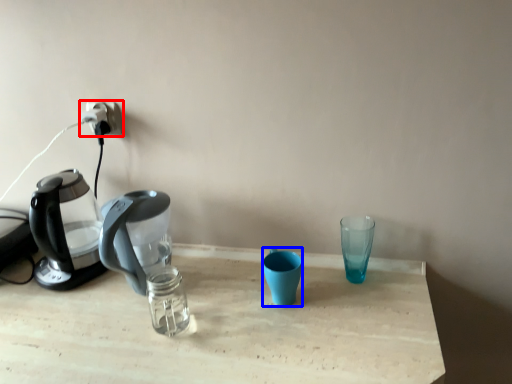
Question: Which of the following is the closest to the observer, power plugs and sockets (highlighted by a red box) or coffee cup (highlighted by a blue box)?

Choices:
 (A) power plugs and sockets
 (B) coffee cup

Answer: (B)